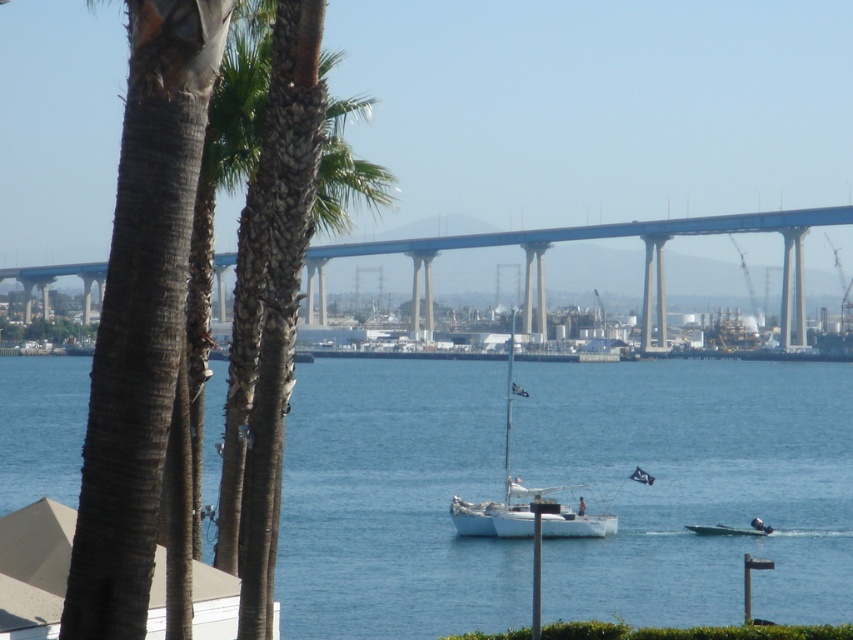
Question: Which point is closer to the camera?

Choices:
 (A) (746, 522)
 (B) (534, 520)

Answer: (B)

Question: Is blue concrete bridge at center smaller than white matte sailboat at center?

Choices:
 (A) yes
 (B) no

Answer: (B)

Question: Which object is positioned closest to the white matte sailboat at center?

Choices:
 (A) blue concrete bridge at center
 (B) blue water at center

Answer: (B)

Question: Is blue water at center to the left of blue concrete bridge at center from the viewer's perspective?

Choices:
 (A) yes
 (B) no

Answer: (A)

Question: Which of the following is the closest to the observer?

Choices:
 (A) (309, 269)
 (B) (526, 516)

Answer: (B)

Question: Can you confirm if blue concrete bridge at center is positioned above white matte sailboat at center?

Choices:
 (A) yes
 (B) no

Answer: (A)